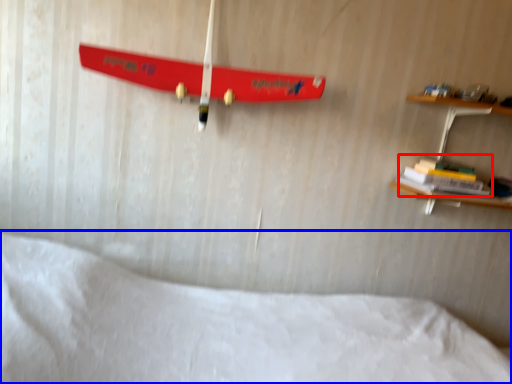
Question: Which of the following is the farthest to the observer, book (highlighted by a red box) or bed (highlighted by a blue box)?

Choices:
 (A) book
 (B) bed

Answer: (A)